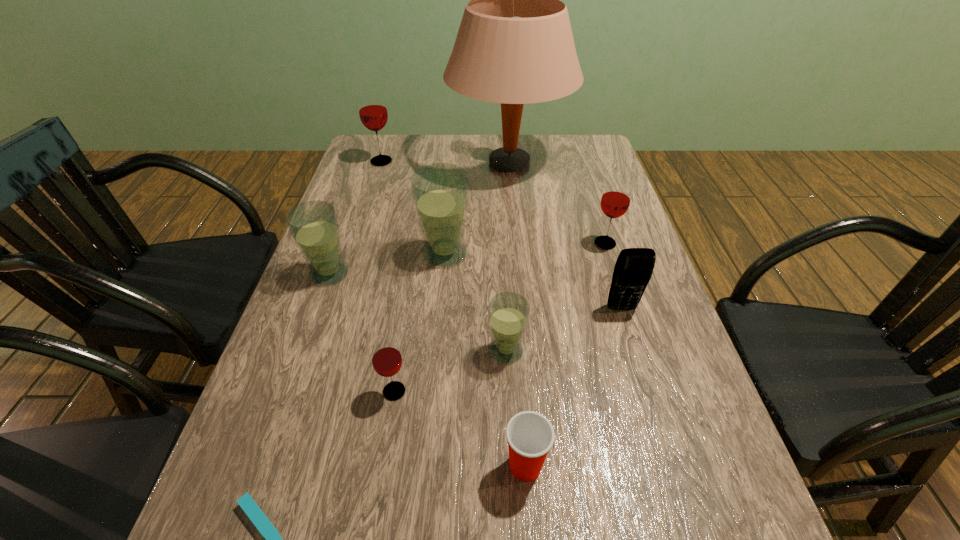
The width and height of the screenshot is (960, 540). I want to click on the third closest blue glass to the spoon, so click(x=440, y=191).

Find the location of a particular element. This screenshot has height=540, width=960. vacant space that satisfies the following two spatial constraints: 1. on the front side of the second biggest red glass; 2. on the left side of the leftmost red glass is located at coordinates (355, 244).